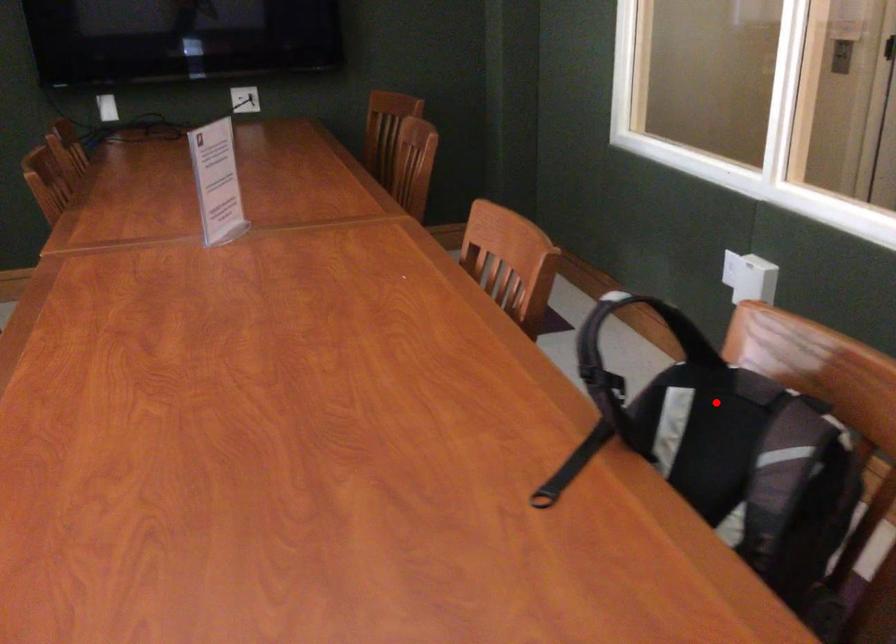
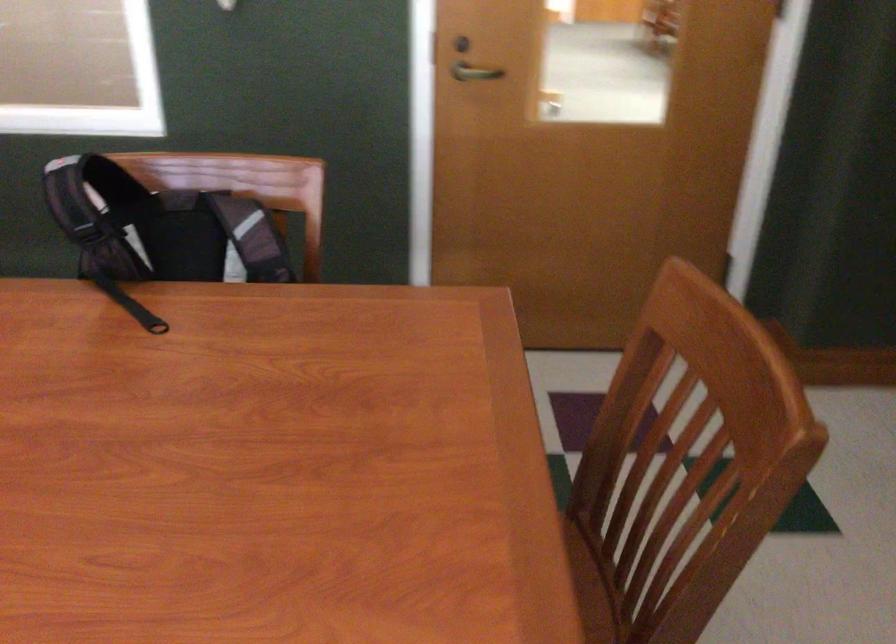
In the second image, find the point that corresponds to the highlighted location in the first image.

(159, 228)